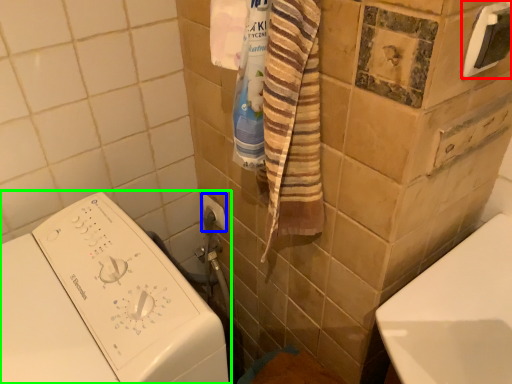
Question: Considering the real-world distances, which object is farthest from towel bar (highlighted by a red box)? towel bar (highlighted by a blue box) or washing machine (highlighted by a green box)?

Choices:
 (A) towel bar
 (B) washing machine

Answer: (A)